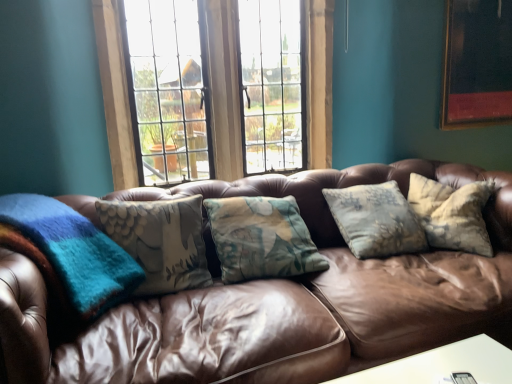
Question: Which is correct: wooden frame window at center is inside brown leather couch at center, or outside of it?

Choices:
 (A) inside
 (B) outside

Answer: (B)

Question: Considering the positions of wooden frame window at center and brown leather couch at center in the image, is wooden frame window at center bigger or smaller than brown leather couch at center?

Choices:
 (A) small
 (B) big

Answer: (A)

Question: Considering the real-world distances, which object is farthest from the wooden picture frame at upper right?

Choices:
 (A) brown leather couch at center
 (B) wooden frame window at center

Answer: (B)

Question: Which object is the farthest from the wooden picture frame at upper right?

Choices:
 (A) brown leather couch at center
 (B) wooden frame window at center

Answer: (B)